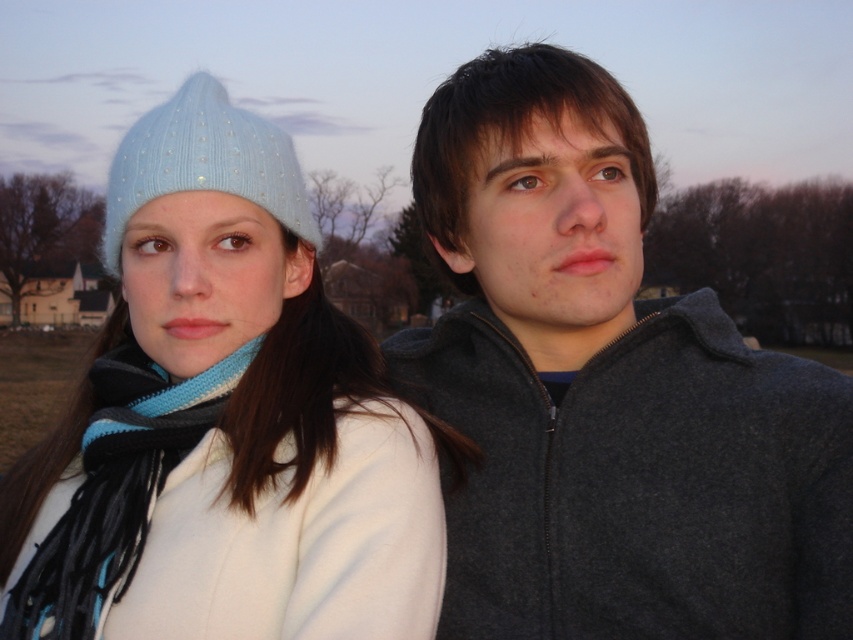
This screenshot has width=853, height=640. Describe the element at coordinates (607, 388) in the screenshot. I see `charcoal fleece jacket at center` at that location.

Who is lower down, charcoal fleece jacket at center or blue knitted scarf at left?

blue knitted scarf at left

Who is more distant from viewer, (840, 444) or (202, 406)?

Positioned behind is point (202, 406).

You are a GUI agent. You are given a task and a screenshot of the screen. Output one action in this format:
    pyautogui.click(x=<x>, y=<y>)
    Task: Click on the charcoal fleece jacket at center
    
    Given the screenshot: What is the action you would take?
    pyautogui.click(x=607, y=388)

Does light blue knit beanie at upper left have a lesser width compared to light blue knitted hat at upper left?

Yes.

Which is in front, point (78, 564) or point (143, 170)?

Point (78, 564)

The height and width of the screenshot is (640, 853). Find the location of `light blue knit beanie at upper left`. light blue knit beanie at upper left is located at coordinates (222, 420).

Between charcoal fleece jacket at center and light blue knit beanie at upper left, which one is positioned lower?

light blue knit beanie at upper left is lower down.

Measure the distance between charcoal fleece jacket at center and light blue knit beanie at upper left.

The distance of charcoal fleece jacket at center from light blue knit beanie at upper left is 19.46 inches.

Who is more forward, (705, 573) or (141, 275)?

Positioned in front is point (705, 573).

Find the location of `charcoal fleece jacket at center`. charcoal fleece jacket at center is located at coordinates (607, 388).